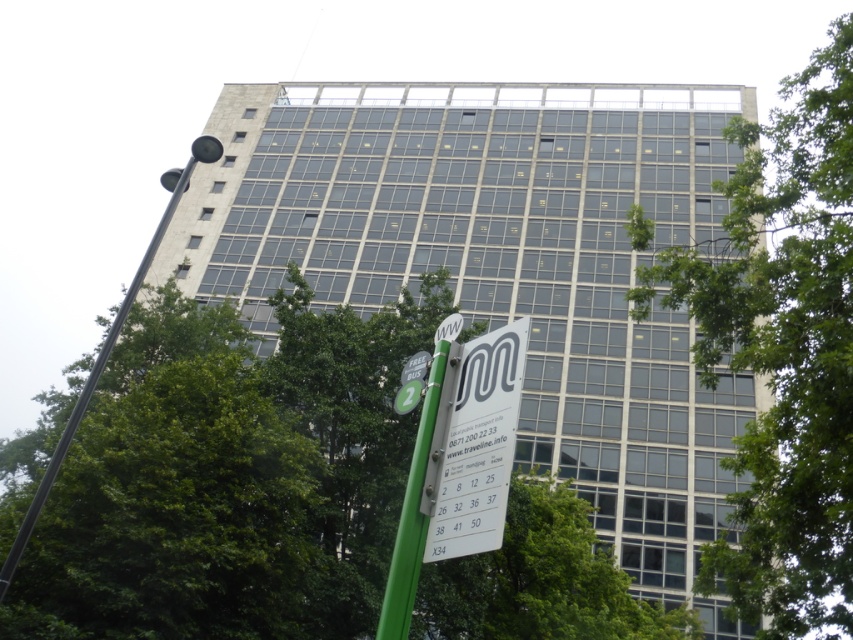
Question: Is green leafy tree at lower center below white plastic sign at lower center?

Choices:
 (A) yes
 (B) no

Answer: (A)

Question: In this image, where is white plastic sign at lower center located relative to black metal pole at left?

Choices:
 (A) above
 (B) below

Answer: (B)

Question: Which point is farther from the camera taking this photo?

Choices:
 (A) (415, 460)
 (B) (743, 595)

Answer: (B)

Question: Does green leafy tree at lower center have a larger size compared to white plastic sign at lower center?

Choices:
 (A) yes
 (B) no

Answer: (A)

Question: Which of the following is the farthest from the observer?

Choices:
 (A) (425, 580)
 (B) (421, 413)
 (C) (181, 172)

Answer: (A)

Question: Which object is the closest to the black metal pole at left?

Choices:
 (A) green metallic pole at lower center
 (B) green leafy tree at center

Answer: (A)